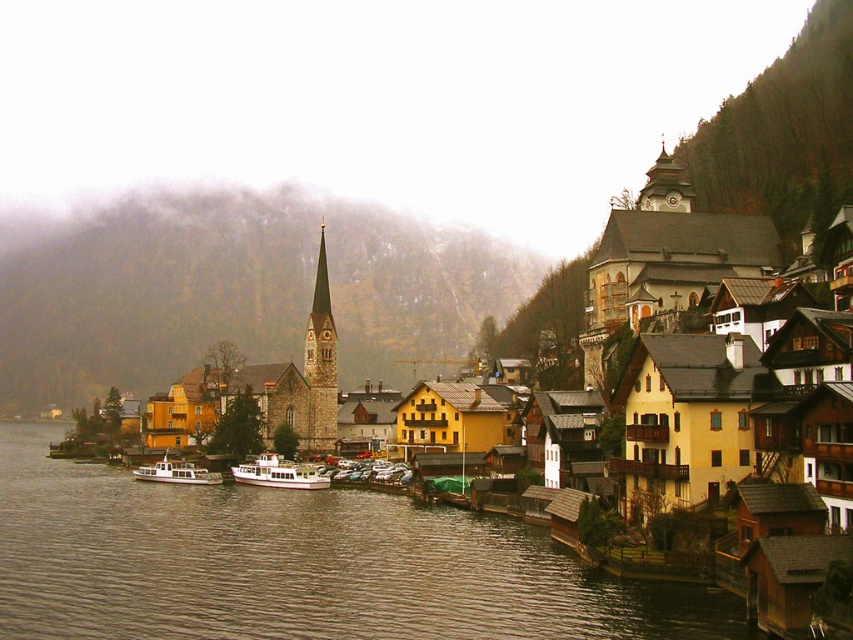
Question: Considering the real-world distances, which object is farthest from the white glossy boat at center?

Choices:
 (A) smooth stone spire at center
 (B) brown water at lower left

Answer: (A)

Question: In this image, where is yellow wooden houses at center located relative to white matte boat at lower left?

Choices:
 (A) below
 (B) above

Answer: (B)

Question: Estimate the real-world distances between objects in this image. Which object is farther from the white glossy boat at center?

Choices:
 (A) smooth stone spire at center
 (B) white matte boat at lower left
 (C) yellow wooden houses at center

Answer: (A)

Question: Among these objects, which one is nearest to the camera?

Choices:
 (A) white matte boat at lower left
 (B) smooth stone spire at center
 (C) white glossy boat at center

Answer: (C)

Question: Is brown water at lower left smaller than white matte boat at lower left?

Choices:
 (A) yes
 (B) no

Answer: (B)

Question: Is brown water at lower left wider than smooth stone spire at center?

Choices:
 (A) yes
 (B) no

Answer: (A)